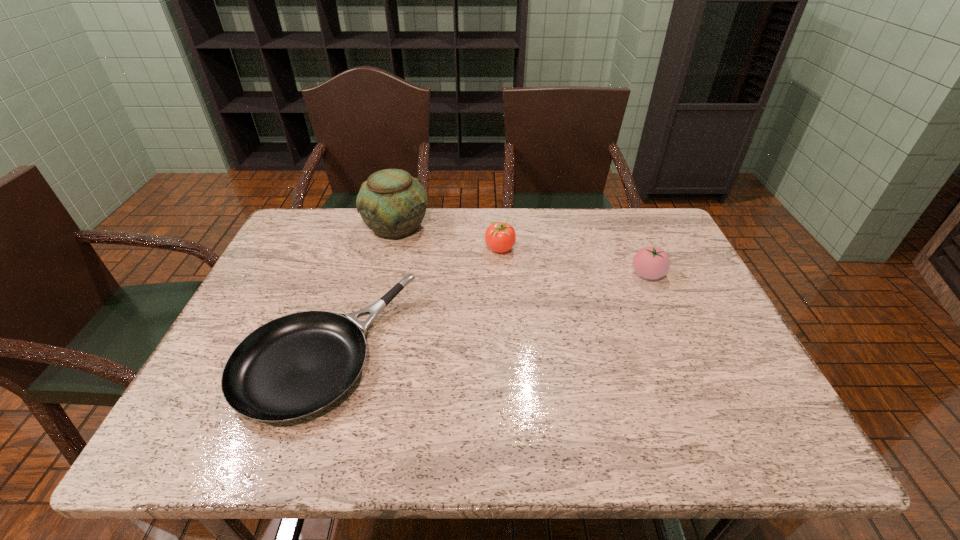
This screenshot has height=540, width=960. What are the coordinates of `vacant area situated on the back of the pan` in the screenshot? It's located at (365, 237).

I want to click on pottery situated at the far edge, so click(x=392, y=203).

Where is `tomato that is at the far edge`? tomato that is at the far edge is located at coordinates (500, 237).

Locate an element on the screen. object at the near edge is located at coordinates (294, 366).

At what (x,y) coordinates should I click in order to perform the action: click on object that is at the left edge. Please return your answer as a coordinate pair (x, y). The height and width of the screenshot is (540, 960). Looking at the image, I should click on (294, 366).

The height and width of the screenshot is (540, 960). Identify the location of object that is at the right edge. (650, 262).

Identify the location of object that is positioned at the near left corner. This screenshot has height=540, width=960. (294, 366).

The height and width of the screenshot is (540, 960). In the image, there is a desktop. Find the location of `vacant space at the far edge`. vacant space at the far edge is located at coordinates (485, 235).

This screenshot has height=540, width=960. In order to click on free space at the near edge of the desktop in this screenshot , I will do `click(566, 448)`.

The height and width of the screenshot is (540, 960). Find the location of `free space at the right edge of the desktop`. free space at the right edge of the desktop is located at coordinates [x=688, y=318].